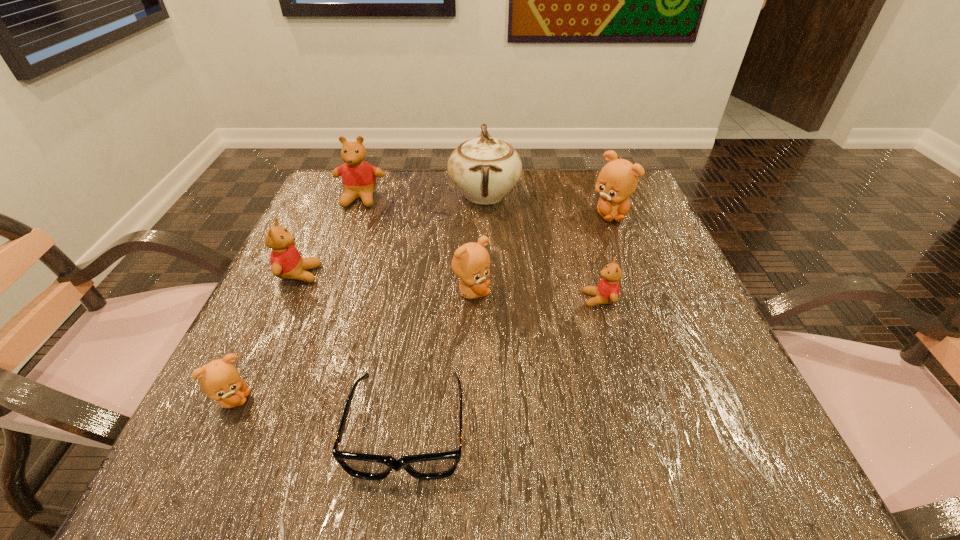
Identify the location of free spot that satisfies the following two spatial constraints: 1. on the front-facing side of the farthest red teddy bear; 2. on the front-facing side of the second biggest red teddy bear. The height and width of the screenshot is (540, 960). [332, 274].

Where is `vacant space that satisfies the following two spatial constraints: 1. on the face of the rightmost teddy bear; 2. on the front-facing side of the second smallest red teddy bear`? Image resolution: width=960 pixels, height=540 pixels. vacant space that satisfies the following two spatial constraints: 1. on the face of the rightmost teddy bear; 2. on the front-facing side of the second smallest red teddy bear is located at coordinates (633, 274).

At what (x,y) coordinates should I click in order to perform the action: click on free point that satisfies the following two spatial constraints: 1. on the face of the rightmost object; 2. on the front-facing side of the second smallest red teddy bear. Please return your answer as a coordinate pair (x, y). The width and height of the screenshot is (960, 540). Looking at the image, I should click on (633, 274).